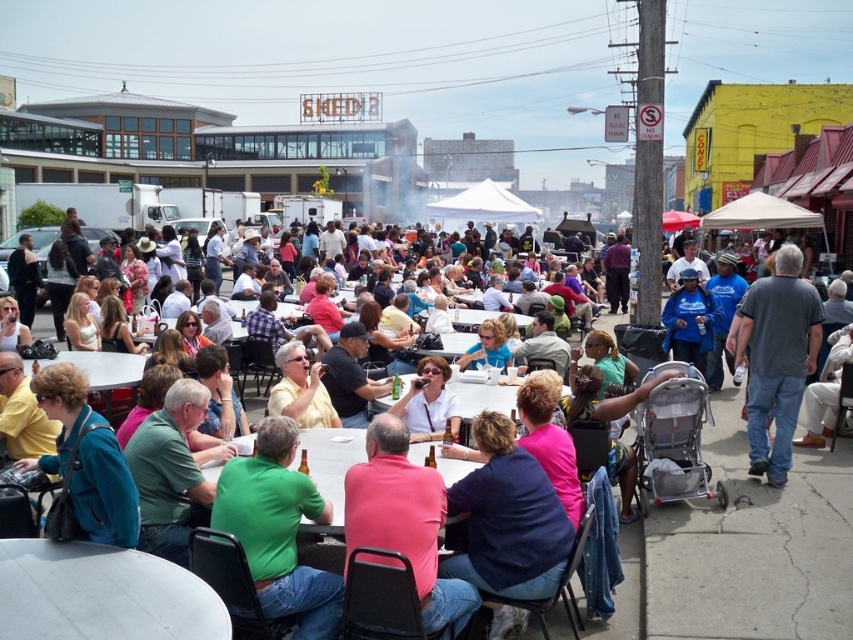
Question: Which point is closer to the camera?

Choices:
 (A) (325, 596)
 (B) (463, 388)

Answer: (A)

Question: Estimate the real-world distances between objects in this image. Which object is closer to the matte plastic table at center?

Choices:
 (A) white matte shirt at center
 (B) white plastic table at lower left
 (C) pink fabric shirt at center

Answer: (A)

Question: Which object is the closest to the gray cotton t-shirt at center-right?

Choices:
 (A) white matte shirt at center
 (B) white plastic table at center
 (C) matte plastic table at center
 (D) green matte shirt at center

Answer: (B)

Question: Is white plastic table at lower left bigger than green matte shirt at center?

Choices:
 (A) no
 (B) yes

Answer: (A)

Question: Is yellow matte shirt at center below white matte shirt at center?

Choices:
 (A) no
 (B) yes

Answer: (A)

Question: In this image, where is white plastic table at lower left located relative to gray cotton t-shirt at center-right?

Choices:
 (A) right
 (B) left

Answer: (B)